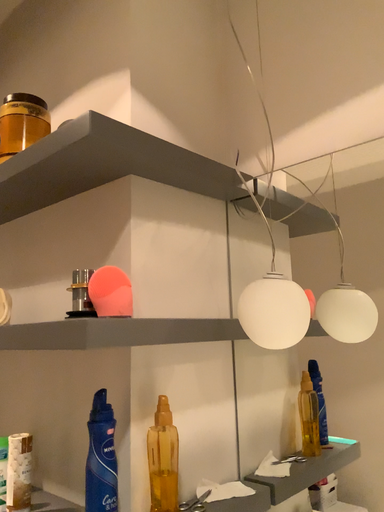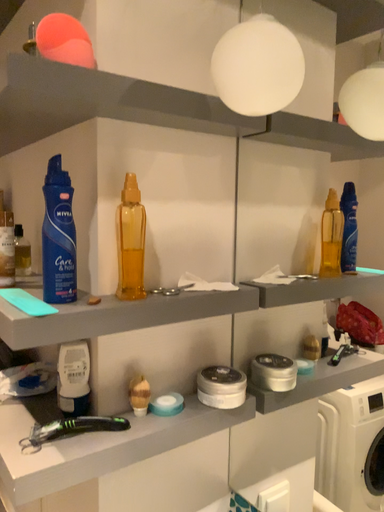
Question: How did the camera likely rotate when shooting the video?

Choices:
 (A) rotated left
 (B) rotated right

Answer: (A)